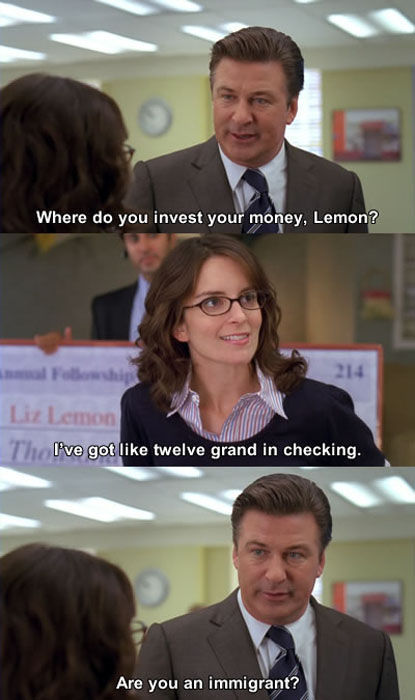
Locate an element on the screen. This screenshot has height=700, width=415. clock is located at coordinates (153, 591), (153, 125).